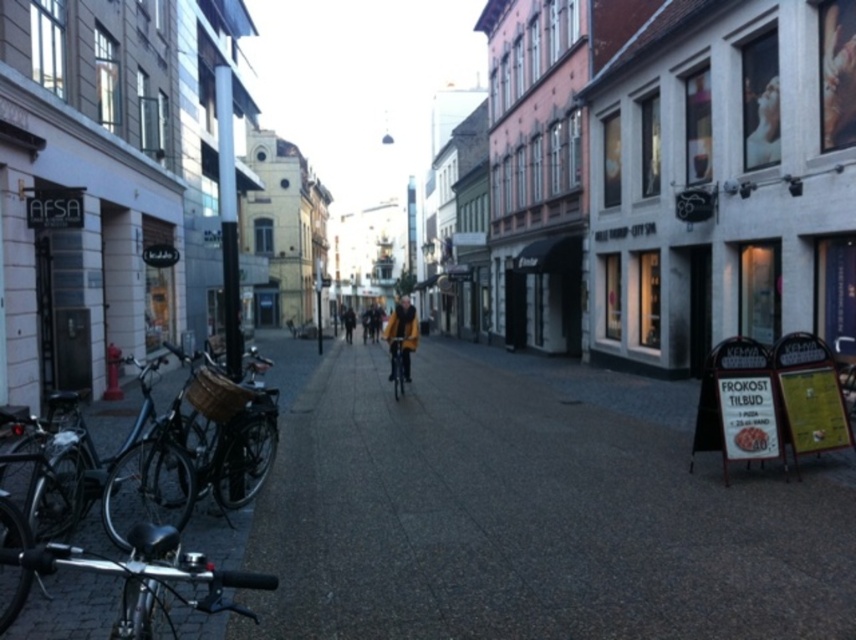
Measure the distance between shiny black bicycle at left and shiny metallic bicycle at center.

shiny black bicycle at left is 6.54 meters away from shiny metallic bicycle at center.

Can you confirm if shiny black bicycle at left is bigger than shiny metallic bicycle at center?

Yes.

Locate an element on the screen. The width and height of the screenshot is (856, 640). shiny black bicycle at left is located at coordinates (76, 465).

Identify the location of shiny black bicycle at left. Image resolution: width=856 pixels, height=640 pixels. (76, 465).

Consider the image. Can you confirm if smooth concrete pavement at center is positioned above yellow coat at center?

Incorrect, smooth concrete pavement at center is not positioned above yellow coat at center.

Is point (396, 460) more distant than point (351, 330)?

No.

You are a GUI agent. You are given a task and a screenshot of the screen. Output one action in this format:
    pyautogui.click(x=<x>, y=<y>)
    Task: Click on the smooth concrete pavement at center
    This screenshot has height=640, width=856.
    Given the screenshot: What is the action you would take?
    pyautogui.click(x=533, y=513)

Which is more to the left, shiny black bicycle at left or yellow wool coat at center?

From the viewer's perspective, shiny black bicycle at left appears more on the left side.

Does shiny black bicycle at left have a larger size compared to yellow wool coat at center?

No.

At what (x,y) coordinates should I click in order to perform the action: click on shiny black bicycle at left. Please return your answer as a coordinate pair (x, y). This screenshot has width=856, height=640. Looking at the image, I should click on (76, 465).